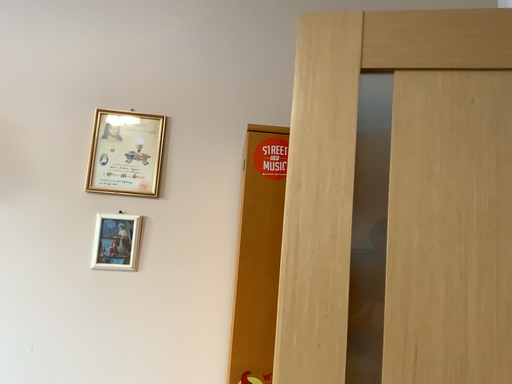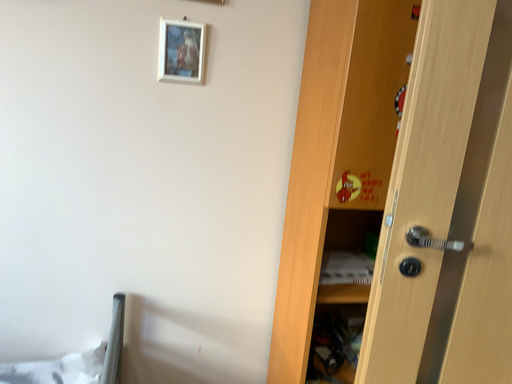
Question: How did the camera likely rotate when shooting the video?

Choices:
 (A) rotated upward
 (B) rotated downward

Answer: (B)